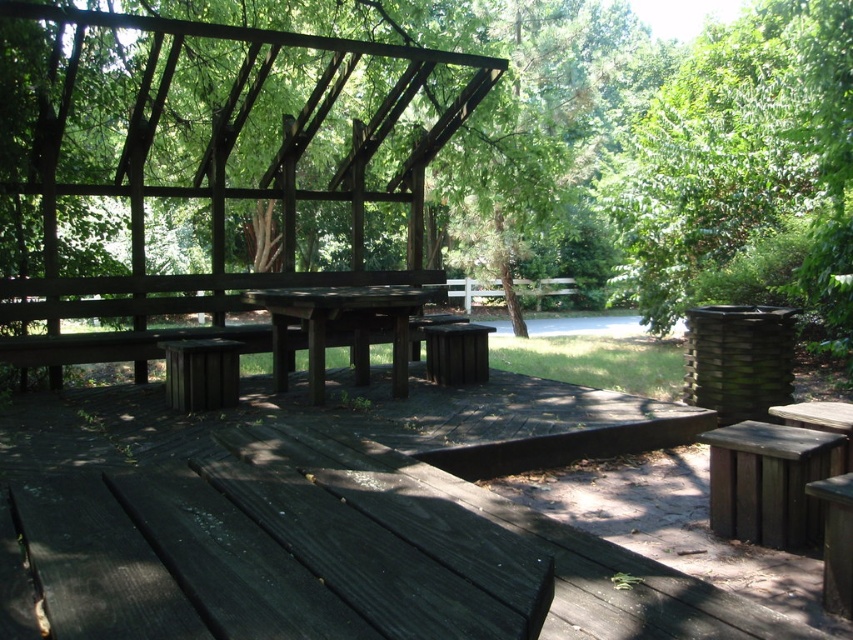
Locate an element on the screen. The image size is (853, 640). dark wood picnic table at center is located at coordinates (335, 520).

Can you confirm if dark wood picnic table at center is thinner than green leafy tree at upper right?

Indeed, dark wood picnic table at center has a lesser width compared to green leafy tree at upper right.

Who is more distant from viewer, [621,417] or [798,96]?

Point [798,96]

The image size is (853, 640). What are the coordinates of `dark wood picnic table at center` in the screenshot? It's located at (335, 520).

Does dark wood picnic table at center have a larger size compared to dark brown wooden table at center?

Actually, dark wood picnic table at center might be smaller than dark brown wooden table at center.

Is dark wood picnic table at center below dark brown wooden table at center?

Correct, dark wood picnic table at center is located below dark brown wooden table at center.

Where is `dark wood picnic table at center`? dark wood picnic table at center is located at coordinates (335, 520).

Is dark wood picnic table at center positioned before dark brown wood bench at lower right?

No, dark wood picnic table at center is further to the viewer.

Locate an element on the screen. dark wood picnic table at center is located at coordinates (335, 520).

Is point (234, 476) less distant than point (805, 518)?

Yes.

This screenshot has width=853, height=640. In order to click on dark wood picnic table at center in this screenshot , I will do `click(335, 520)`.